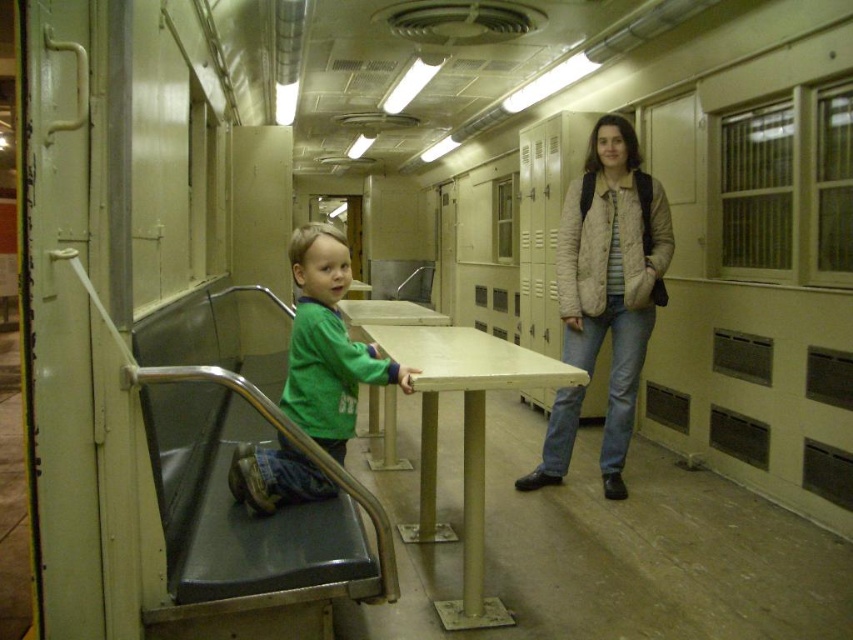
Between light beige textured jacket at center and green matte shirt at center, which one appears on the left side from the viewer's perspective?

green matte shirt at center is more to the left.

Which of these two, light beige textured jacket at center or green matte shirt at center, stands taller?

With more height is light beige textured jacket at center.

Is point (605, 152) farther from viewer compared to point (357, 380)?

Yes, point (605, 152) is farther from viewer.

Identify the location of light beige textured jacket at center. The height and width of the screenshot is (640, 853). (612, 275).

In the scene shown: Is the position of light beige textured jacket at center less distant than that of matte yellow table at center?

No, it is behind matte yellow table at center.

Does point (635, 308) come closer to viewer compared to point (483, 532)?

No, it is behind (483, 532).

You are a GUI agent. You are given a task and a screenshot of the screen. Output one action in this format:
    pyautogui.click(x=<x>, y=<y>)
    Task: Click on the light beige textured jacket at center
    The height and width of the screenshot is (640, 853).
    Given the screenshot: What is the action you would take?
    pyautogui.click(x=612, y=275)

Is matte yellow table at center behind green matte shirt at center?

Yes, it is.

Can you confirm if matte yellow table at center is taller than green matte shirt at center?

Indeed, matte yellow table at center has a greater height compared to green matte shirt at center.

Who is more distant from viewer, [463,410] or [312,320]?

The point [463,410] is more distant.

Image resolution: width=853 pixels, height=640 pixels. Find the location of `matte yellow table at center`. matte yellow table at center is located at coordinates (462, 440).